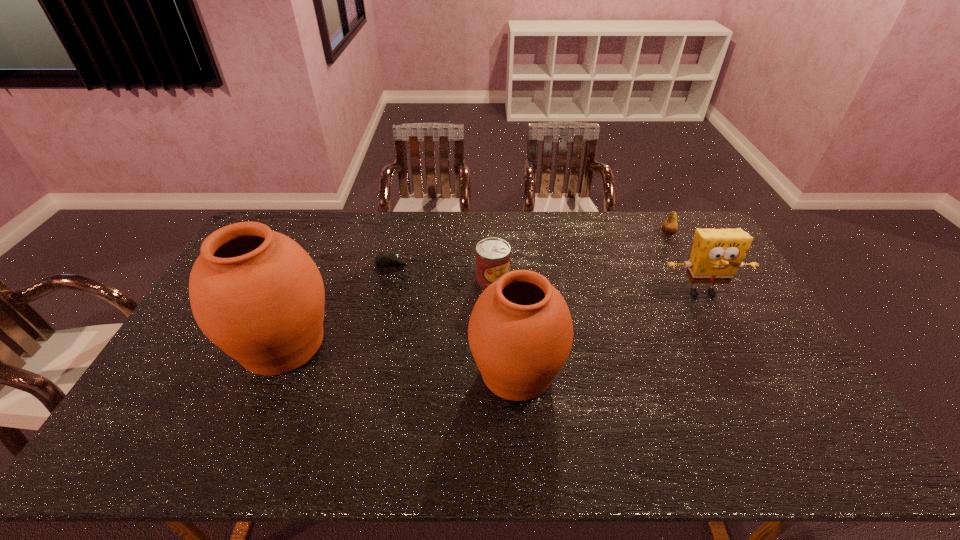
Find the location of a particular element. The image size is (960, 540). vacant space located 0.360m on the back of the second tallest object is located at coordinates (508, 257).

The width and height of the screenshot is (960, 540). Find the location of `vacant position located 0.390m on the front of the farthest object`. vacant position located 0.390m on the front of the farthest object is located at coordinates (711, 315).

At what (x,y) coordinates should I click in order to perform the action: click on free region located on the left of the can. Please return your answer as a coordinate pair (x, y). The width and height of the screenshot is (960, 540). Looking at the image, I should click on (380, 280).

Identify the location of blank area located 0.360m on the button of the fifth nearest object. The height and width of the screenshot is (540, 960). (511, 262).

Locate an element on the screen. free space located 0.160m on the face of the fourth shortest object is located at coordinates (730, 345).

Image resolution: width=960 pixels, height=540 pixels. I want to click on object present at the far edge, so click(670, 226).

What are the coordinates of `object situated at the left edge` in the screenshot? It's located at (255, 293).

Find the location of `pear that is at the right edge`. pear that is at the right edge is located at coordinates (670, 226).

Locate an element on the screen. This screenshot has width=960, height=540. sponge that is at the right edge is located at coordinates click(717, 254).

You are a GUI agent. You are given a task and a screenshot of the screen. Output one action in this format:
    pyautogui.click(x=<x>, y=<y>)
    Task: Click on the object that is at the near left corner
    This screenshot has height=540, width=960.
    Given the screenshot: What is the action you would take?
    pyautogui.click(x=255, y=293)